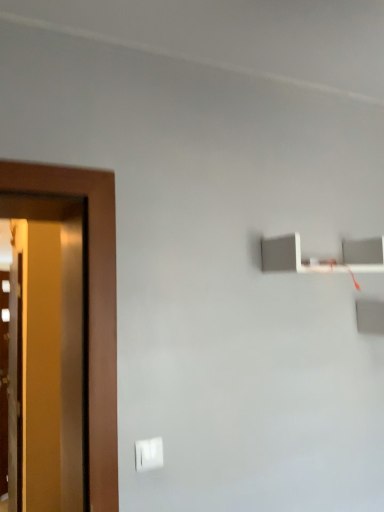
Question: Choose the correct answer: Is white matte shelf at upper right inside white plastic light switch at lower center or outside it?

Choices:
 (A) inside
 (B) outside

Answer: (B)

Question: Considering the relative positions of white matte shelf at upper right and white plastic light switch at lower center in the image provided, is white matte shelf at upper right to the left or to the right of white plastic light switch at lower center?

Choices:
 (A) left
 (B) right

Answer: (B)

Question: In terms of width, does white matte shelf at upper right look wider or thinner when compared to white plastic light switch at lower center?

Choices:
 (A) thin
 (B) wide

Answer: (B)

Question: Which is correct: white plastic light switch at lower center is inside white matte shelf at upper right, or outside of it?

Choices:
 (A) inside
 (B) outside

Answer: (B)

Question: From the image's perspective, is white plastic light switch at lower center located above or below white matte shelf at upper right?

Choices:
 (A) above
 (B) below

Answer: (B)

Question: Does point (140, 463) appear closer or farther from the camera than point (372, 238)?

Choices:
 (A) farther
 (B) closer

Answer: (B)

Question: Is white plastic light switch at lower center wider or thinner than white matte shelf at upper right?

Choices:
 (A) wide
 (B) thin

Answer: (B)